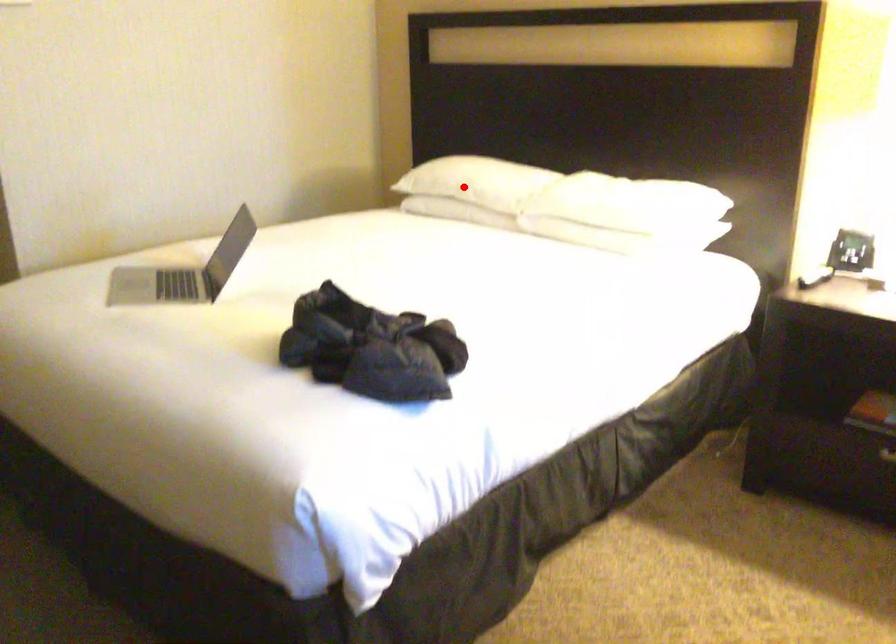
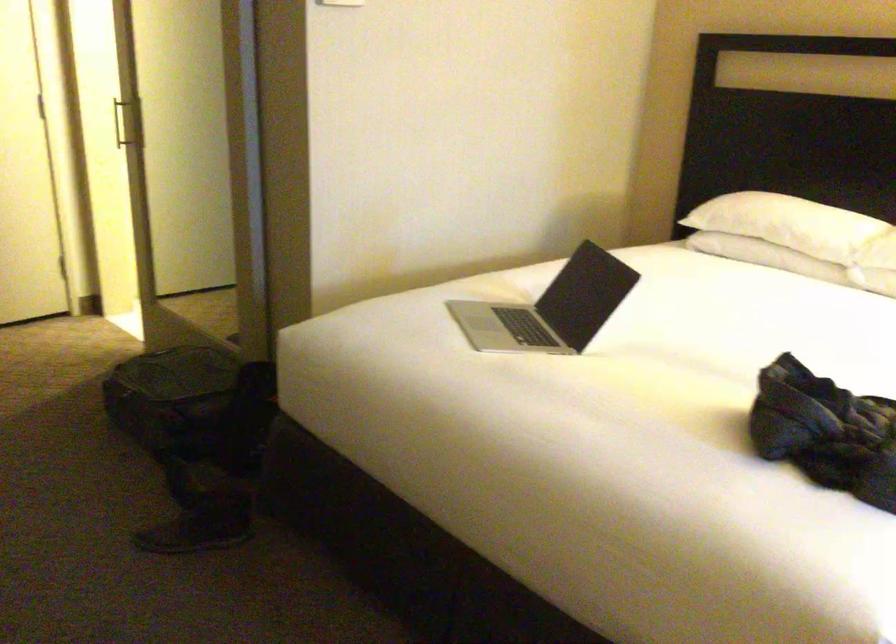
Where in the second image is the point corresponding to the highlighted location from the first image?

(788, 223)